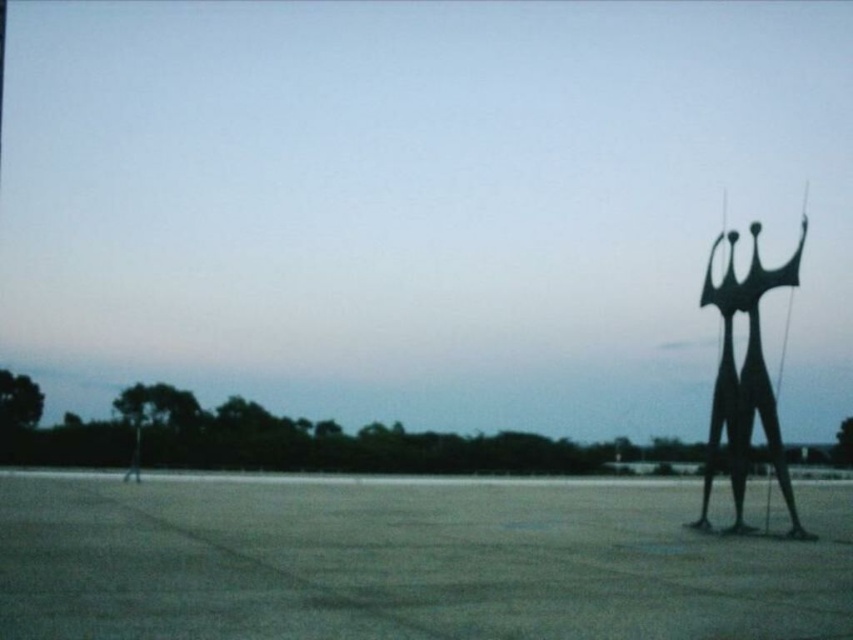
Between smooth concrete tarmac at right and black metal sculpture at right, which one is positioned higher?

Positioned higher is black metal sculpture at right.

From the picture: Which of these two, smooth concrete tarmac at right or black metal sculpture at right, stands shorter?

Standing shorter between the two is black metal sculpture at right.

Between point (360, 593) and point (753, 353), which one is positioned behind?

The point (753, 353) is behind.

At what (x,y) coordinates should I click in order to perform the action: click on smooth concrete tarmac at right. Please return your answer as a coordinate pair (x, y). The width and height of the screenshot is (853, 640). Looking at the image, I should click on (403, 563).